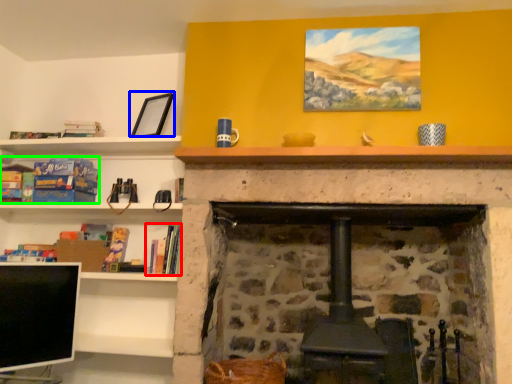
Question: Estimate the real-world distances between objects in this image. Which object is farther from book (highlighted by a red box), picture frame (highlighted by a blue box) or book (highlighted by a green box)?

Choices:
 (A) picture frame
 (B) book

Answer: (A)